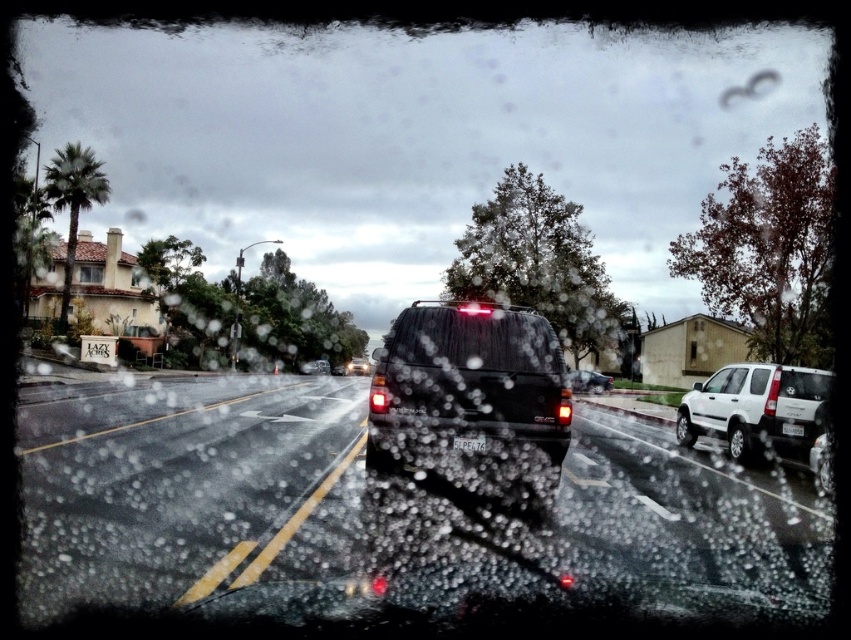
You are driving a car and see the white matte suv at right ahead. You need to stop your car within 10 meters to avoid hitting it. Can you safely stop in time?

The white matte suv at right is 11.40 meters away from the viewer. Since you need to stop within 10 meters, you cannot safely stop in time before reaching it.

You are a passenger in a car and notice the matte black SUV at center through the rain. Based on its position at coordinates 0.608, 0.552, can you determine if it is closer to the front or the rear of the vehicle you are in?

The matte black SUV at center is located at point [469,388]. Since the coordinates are closer to 1 on the x and y axes, it is positioned more towards the rear of your vehicle.